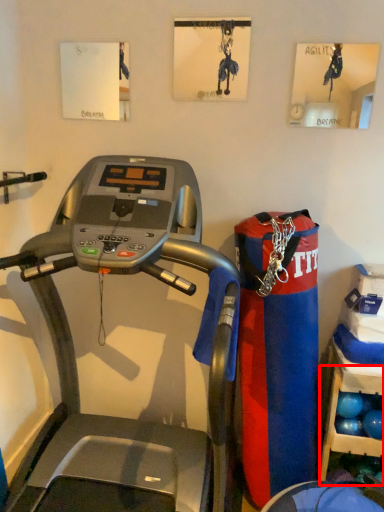
Question: From the image's perspective, where is shelf (annotated by the red box) located relative to treadmill?

Choices:
 (A) above
 (B) below

Answer: (B)